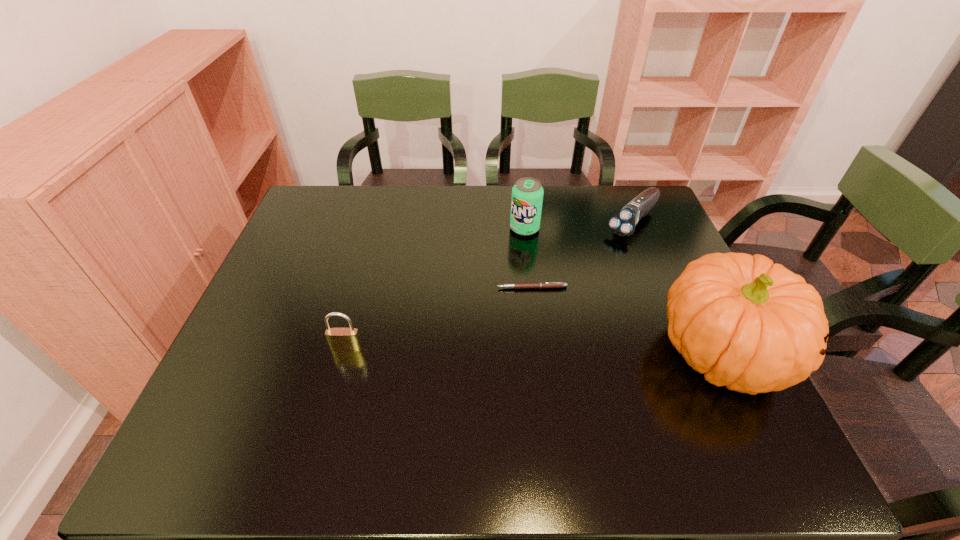
I want to click on vacant space located 0.370m on the head of the fourth tallest object, so click(x=547, y=309).

Identify the location of blank space located 0.150m on the front-facing side of the pop soda. (509, 271).

Where is `free spot located on the front-facing side of the pop soda`? free spot located on the front-facing side of the pop soda is located at coordinates (486, 335).

At what (x,y) coordinates should I click in order to perform the action: click on vacant space located on the front-facing side of the pop soda. Please return your answer as a coordinate pair (x, y). The image size is (960, 540). Looking at the image, I should click on (503, 286).

Locate an element on the screen. This screenshot has height=540, width=960. blank space located 0.290m at the nib of the shortest object is located at coordinates (452, 370).

This screenshot has height=540, width=960. I want to click on free region located at the nib of the shortest object, so click(x=480, y=334).

You are a GUI agent. You are given a task and a screenshot of the screen. Output one action in this format:
    pyautogui.click(x=<x>, y=<y>)
    Task: Click on the free spot located 0.180m at the nib of the shortest object
    This screenshot has width=960, height=540.
    Given the screenshot: What is the action you would take?
    pyautogui.click(x=478, y=336)

Locate an element on the screen. electric shaver that is at the far edge is located at coordinates (623, 223).

Identify the location of pop soda that is at the far edge. (527, 194).

Where is `object that is at the near edge`? The image size is (960, 540). object that is at the near edge is located at coordinates (753, 326).